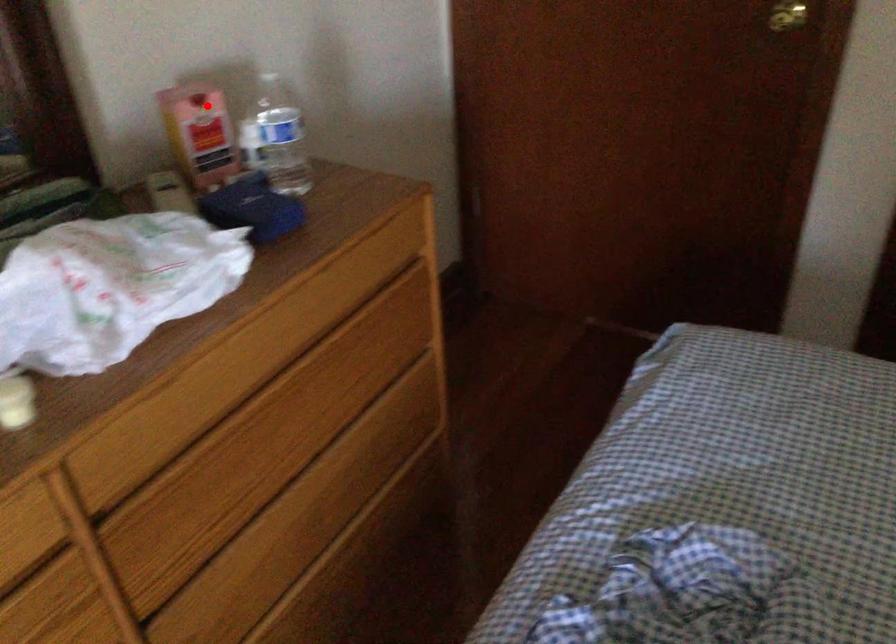
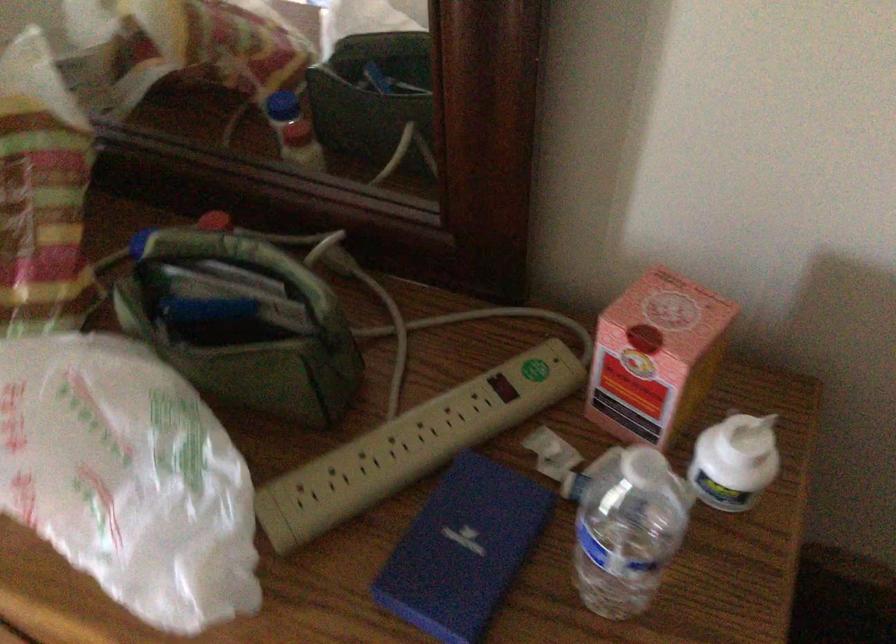
Question: I am providing you with two images of the same scene from different viewpoints. In image1, a red point is highlighted. Considering the same 3D point in image2, which of the following is correct?

Choices:
 (A) It is closer
 (B) It is farther

Answer: (A)